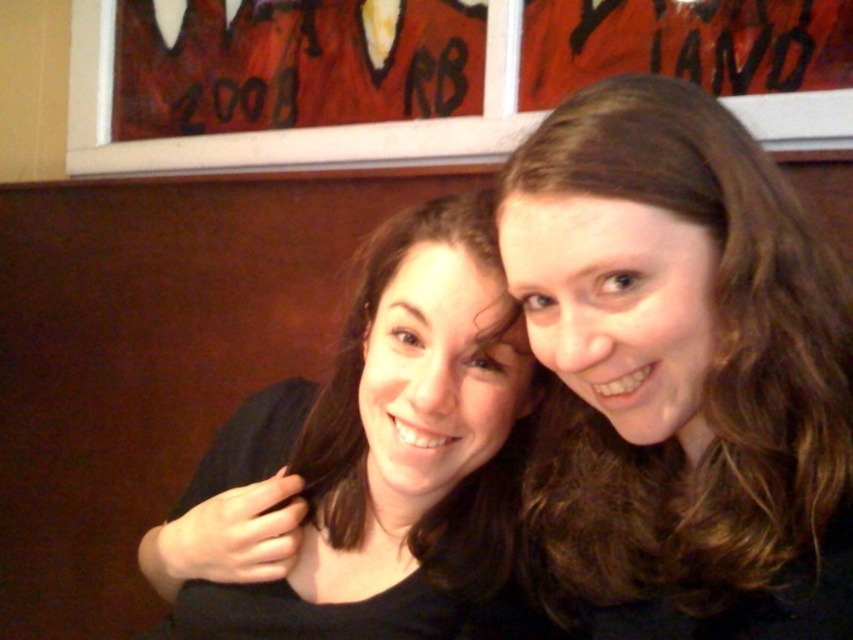
Question: Does brown hair at upper right lie in front of black matte hair at center?

Choices:
 (A) no
 (B) yes

Answer: (B)

Question: Which point is closer to the camera?

Choices:
 (A) black matte hair at center
 (B) brown hair at upper right

Answer: (B)

Question: Which object appears farthest from the camera in this image?

Choices:
 (A) black matte hair at center
 (B) brown hair at upper right

Answer: (A)

Question: Is brown hair at upper right above black matte hair at center?

Choices:
 (A) no
 (B) yes

Answer: (B)

Question: Can you confirm if brown hair at upper right is positioned to the right of black matte hair at center?

Choices:
 (A) yes
 (B) no

Answer: (A)